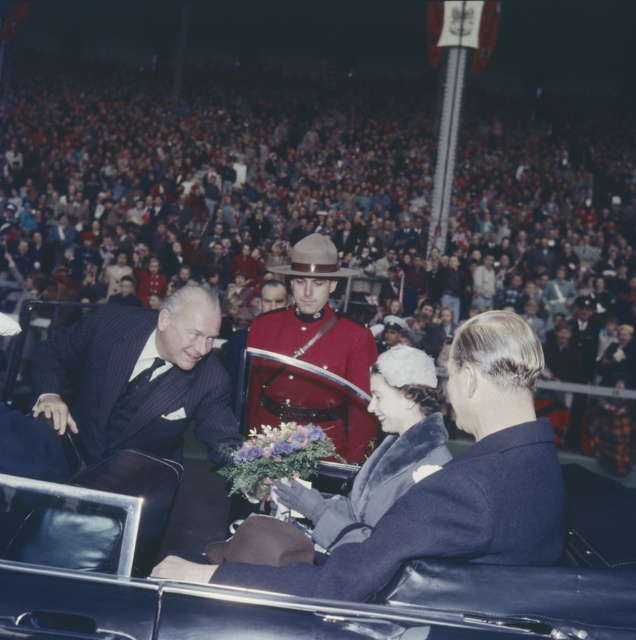
Question: Can you confirm if velvet gray coat at center is positioned below purple silk bouquet at center?

Choices:
 (A) yes
 (B) no

Answer: (B)

Question: Estimate the real-world distances between objects in this image. Which object is closer to the red uniformed officer at center?

Choices:
 (A) purple silk bouquet at center
 (B) velvet gray coat at center
 (C) dark blue pinstripe suit at center

Answer: (C)

Question: Is dark blue pinstripe suit at center positioned in front of red uniformed officer at center?

Choices:
 (A) no
 (B) yes

Answer: (B)

Question: Which is farther from the red uniformed officer at center?

Choices:
 (A) velvet gray coat at center
 (B) purple silk bouquet at center

Answer: (A)

Question: Is dark blue pinstripe suit at center wider than purple silk bouquet at center?

Choices:
 (A) yes
 (B) no

Answer: (A)

Question: Which of these objects is positioned closest to the red uniformed officer at center?

Choices:
 (A) purple silk bouquet at center
 (B) dark blue pinstripe suit at center
 (C) multicolored fabric crowd at upper center

Answer: (B)